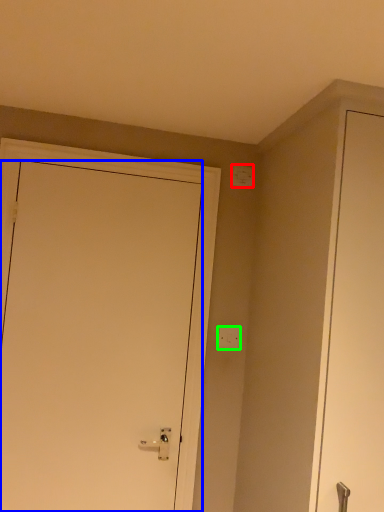
Question: Which is farther away from light switch (highlighted by a red box)? door (highlighted by a blue box) or light switch (highlighted by a green box)?

Choices:
 (A) door
 (B) light switch

Answer: (A)